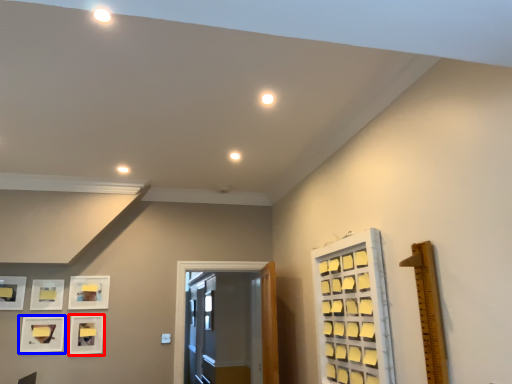
Question: Which of the following is the closest to the observer, picture frame (highlighted by a red box) or picture frame (highlighted by a blue box)?

Choices:
 (A) picture frame
 (B) picture frame

Answer: (B)